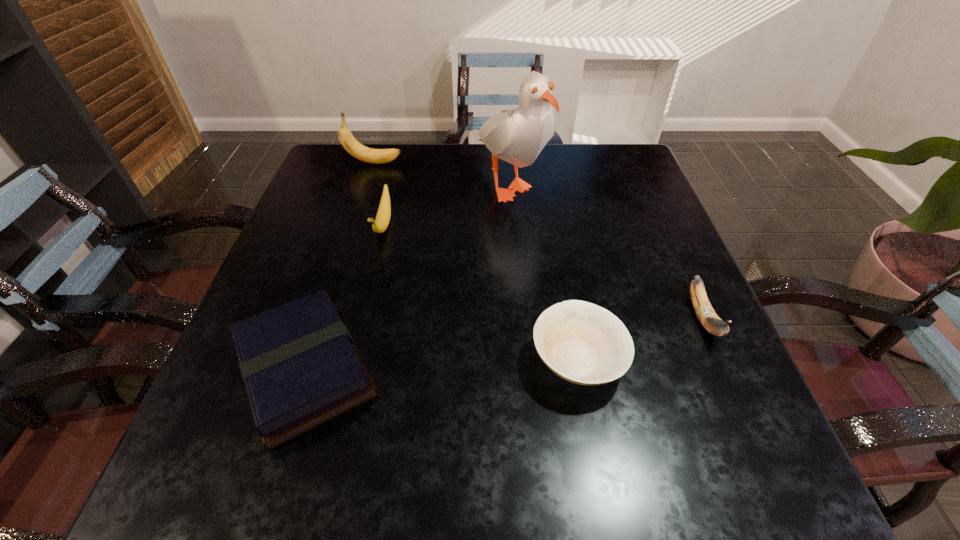
Where is `free space located at the stem of the second farthest banana`? The height and width of the screenshot is (540, 960). free space located at the stem of the second farthest banana is located at coordinates (372, 276).

The image size is (960, 540). I want to click on free space located at the stem of the rightmost object, so click(x=751, y=424).

At what (x,y) coordinates should I click in order to perform the action: click on free region located on the right of the bowl. Please return your answer as a coordinate pair (x, y). Looking at the image, I should click on (659, 361).

Locate an element on the screen. The image size is (960, 540). free space located 0.150m on the back of the book is located at coordinates (342, 254).

Find the location of `gull positioned at the far edge`. gull positioned at the far edge is located at coordinates (517, 135).

The image size is (960, 540). Identify the location of banana that is at the far edge. (376, 156).

This screenshot has width=960, height=540. Find the location of `object that is at the near edge`. object that is at the near edge is located at coordinates (300, 367).

The image size is (960, 540). I want to click on banana that is at the left edge, so click(376, 156).

This screenshot has height=540, width=960. In order to click on book that is at the left edge in this screenshot , I will do `click(300, 367)`.

This screenshot has height=540, width=960. In order to click on object that is at the right edge in this screenshot , I will do `click(709, 319)`.